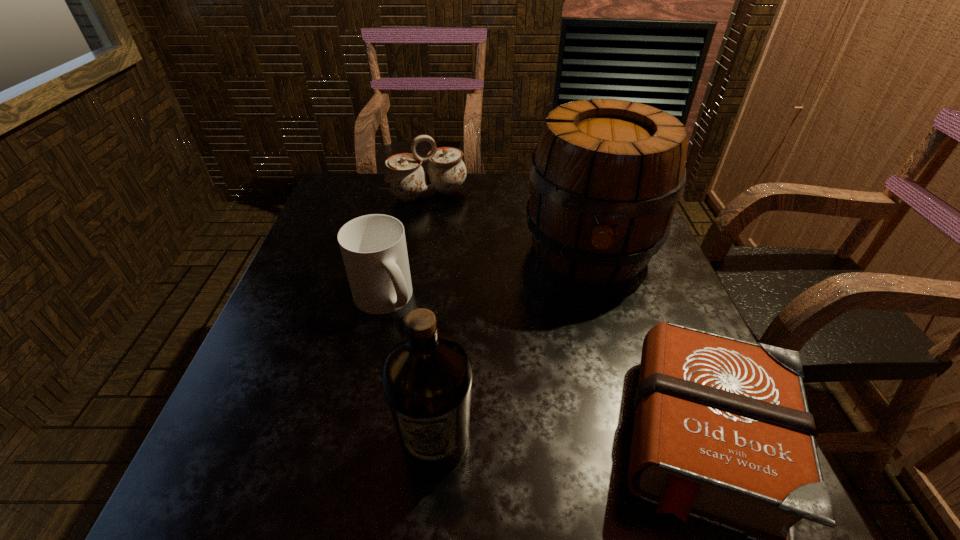
I want to click on vacant space that satisfies the following two spatial constraints: 1. on the front side of the farthest object; 2. on the left side of the cider, so click(x=419, y=251).